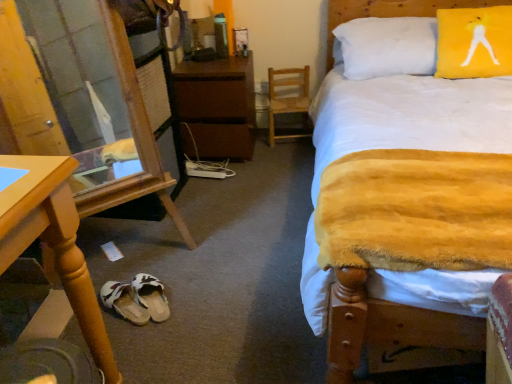
You are a GUI agent. You are given a task and a screenshot of the screen. Output one action in this format:
    pyautogui.click(x=<x>, y=<y>)
    Task: Click on the free spot above brown matte nightstand at center (from a real-world perspective)
    
    Given the screenshot: What is the action you would take?
    pyautogui.click(x=215, y=61)